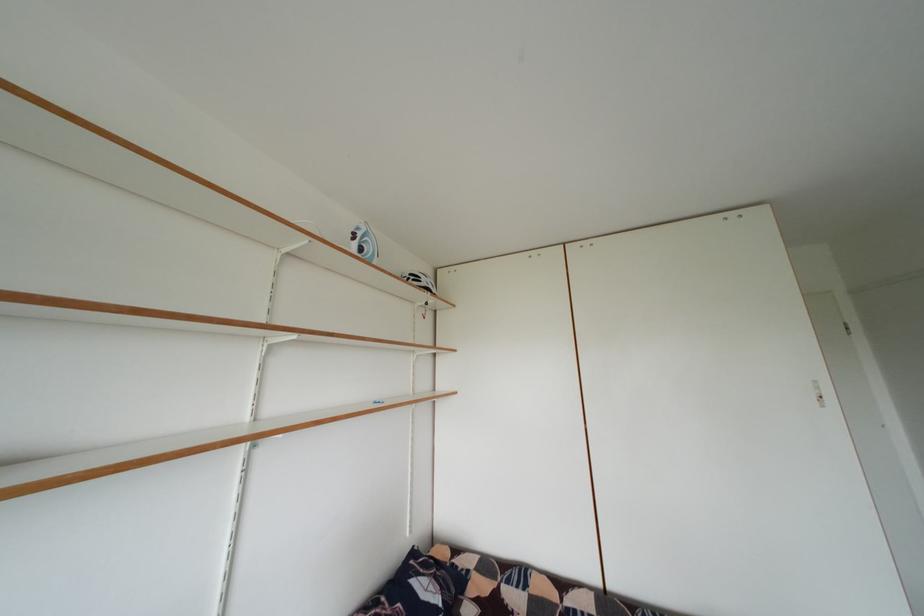
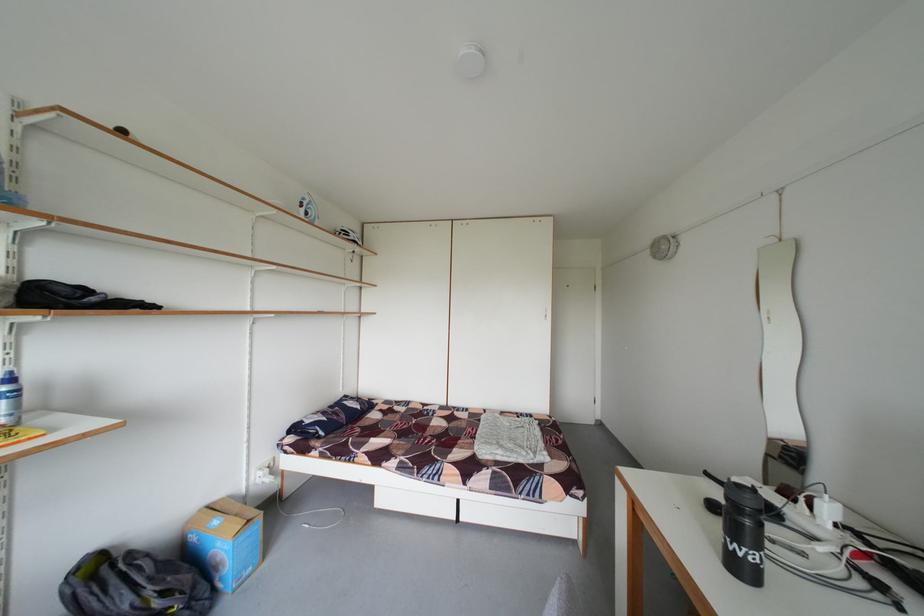
Find the pixel in the second image that matches [370,241] in the first image.

(315, 209)